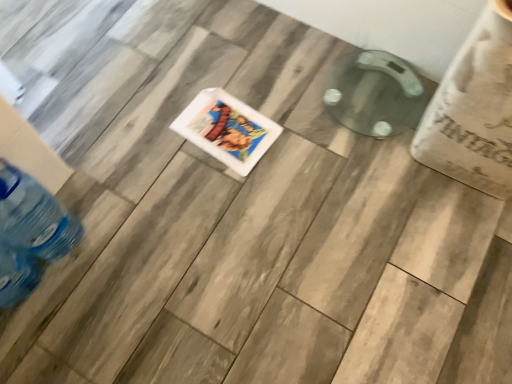
Find the location of a particular element. This screenshot has height=384, width=512. vacant space behind white glossy comic book at center is located at coordinates (233, 73).